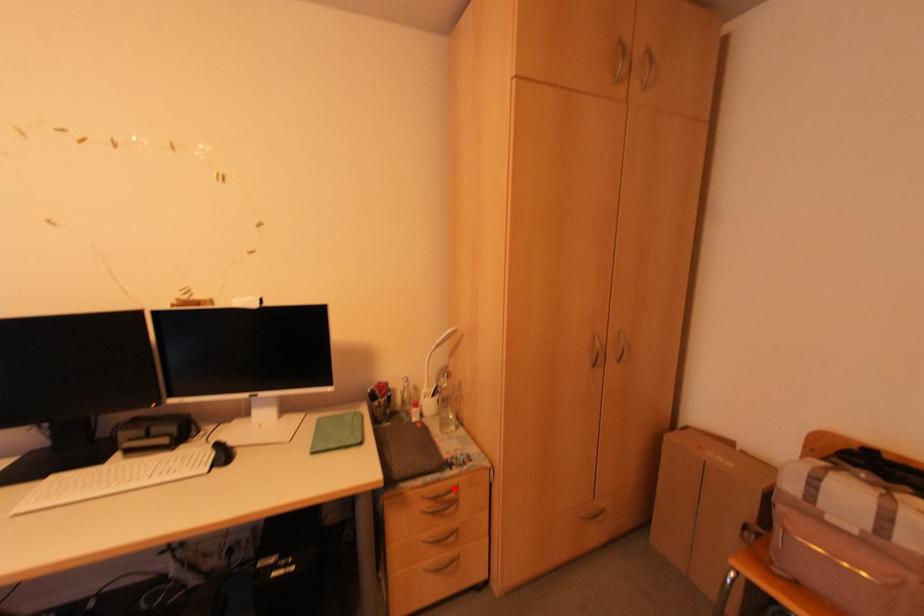
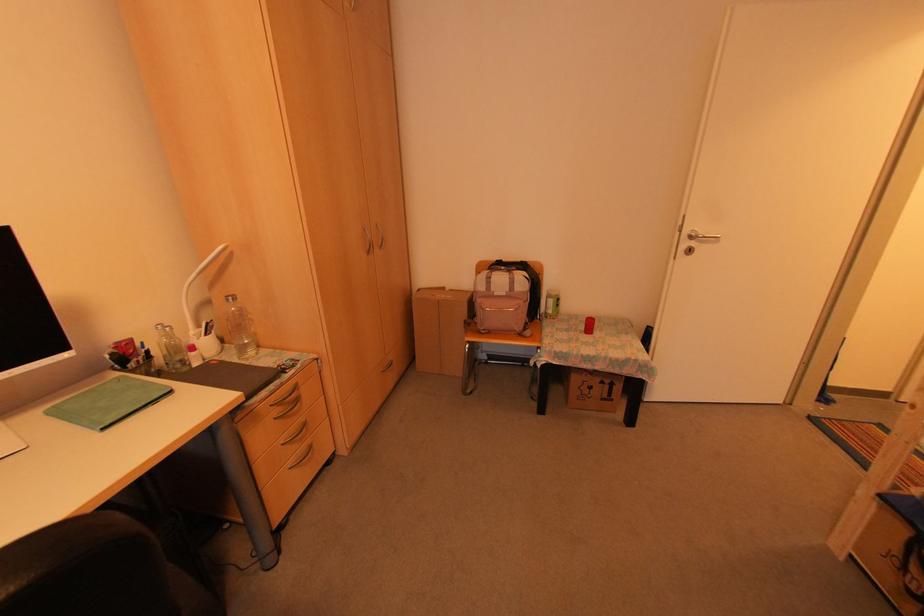
The point at the highlighted location is marked in the first image. Where is the corresponding point in the second image?

(294, 387)